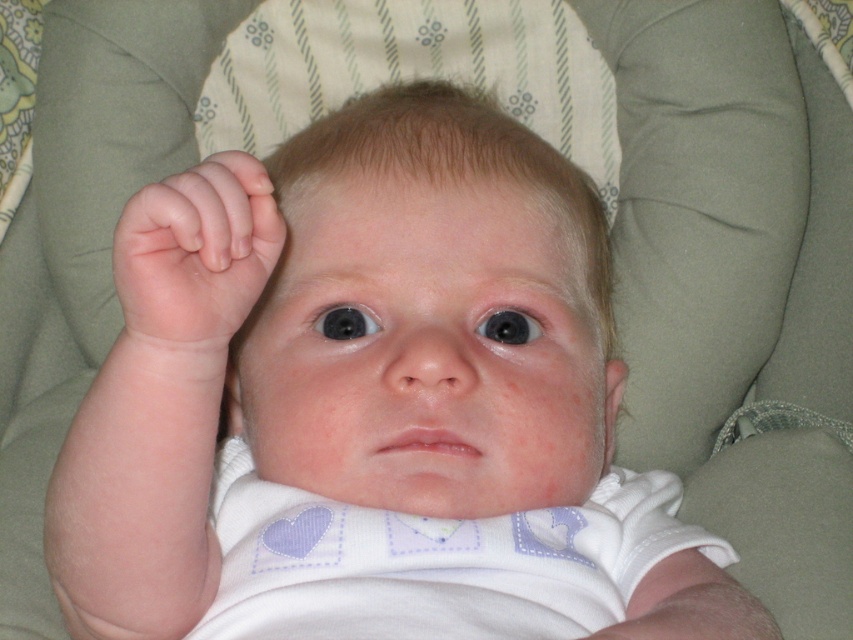
Based on the scene description, where is the smooth skin head at center located in the image?

The smooth skin head at center is located at point coordinates of approximately 0.492 on the x axis and 0.505 on the y axis.